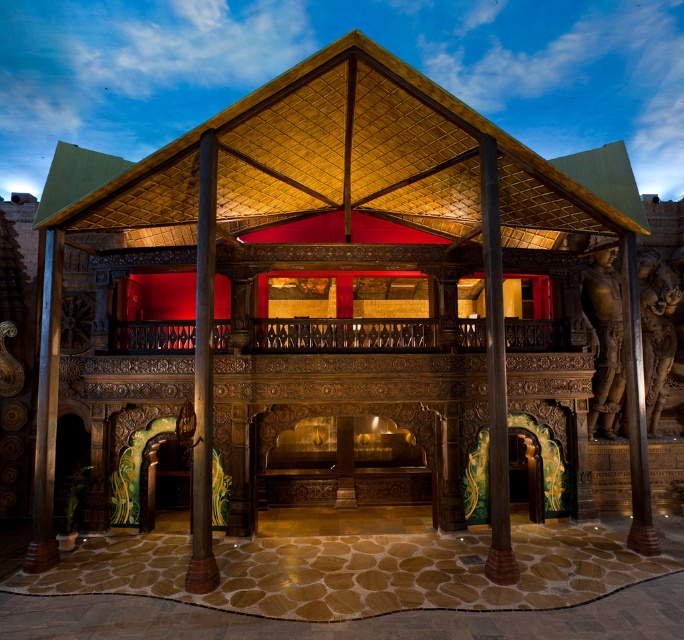
You are standing in front of the pavilion and notice a point marked at coordinates (345, 163). What does this point indicate in the pavilion?

The point at coordinates (345, 163) indicates the location of the gold textured canopy at center.

You are an architect visiting the pavilion and want to compare the heights of the brown polished wood statue at right and the wooden pillar at center. Which one is taller?

The brown polished wood statue at right is taller than the wooden pillar at center.

You are a maintenance worker needing to inspect both the gold textured canopy at center and the wooden railing at center. Given that your ladder can extend up to 3 meters, will you be able to safely reach both objects without moving the ladder?

The distance between the gold textured canopy at center and the wooden railing at center is 2.93 meters, which is within the ladder extension limit of 3 meters. Therefore, you can safely reach both objects without moving the ladder.